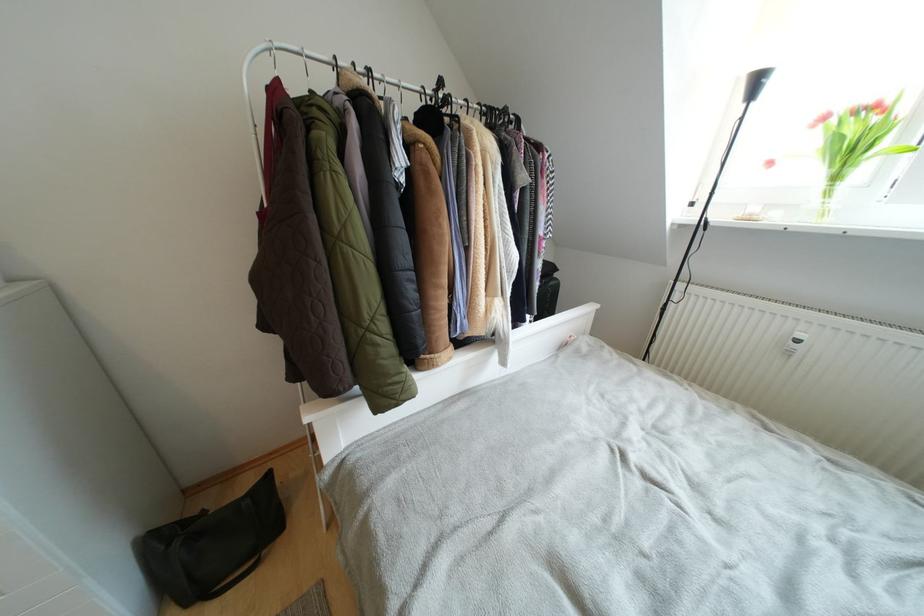
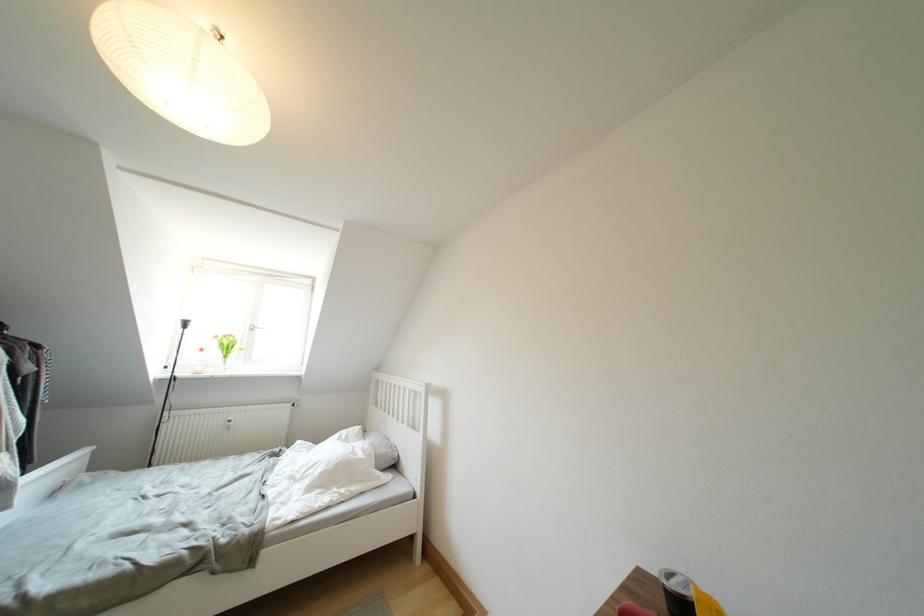
Locate, in the second image, the point that corresponds to point (830, 122) in the first image.

(222, 341)